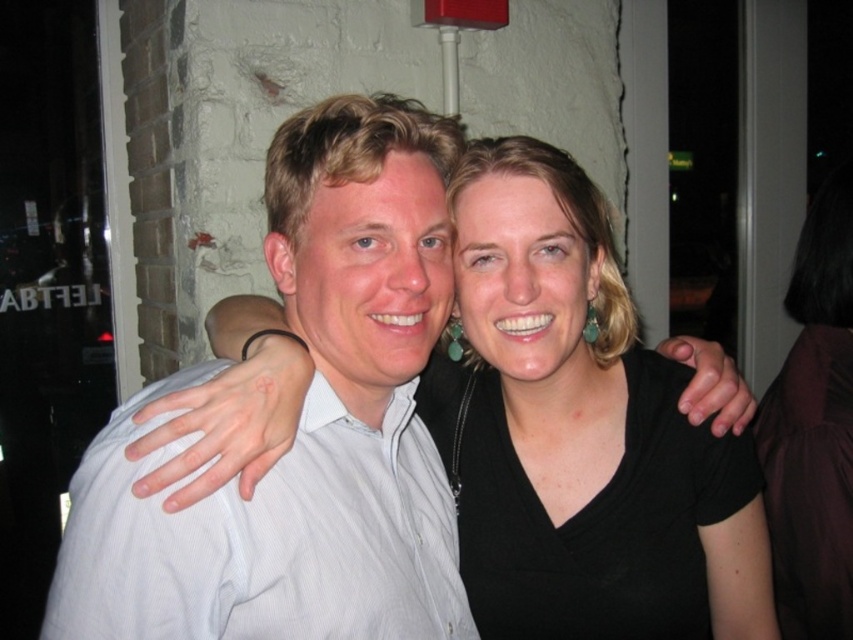
You are a tailor who needs to determine which item requires more fabric for alterations. You have a black matte shirt at center and a black fabric at right. Based on their sizes, which one would need more material?

The black matte shirt at center requires more fabric for alterations since it has a larger size compared to the black fabric at right.

You are organizing a clothing donation drive and need to determine which item takes up more space. Based on the image, which object is wider between the white striped shirt at left and the black fabric at right?

The white striped shirt at left is wider than the black fabric at right, so it takes up more space.

You are trying to decide which shirt to wear for a casual day out. You have a white striped shirt at left and a black matte shirt at center. Based on the image, which shirt is positioned to the left?

The white striped shirt at left is positioned to the left of the black matte shirt at center, so the white striped shirt at left is the one on the left side.